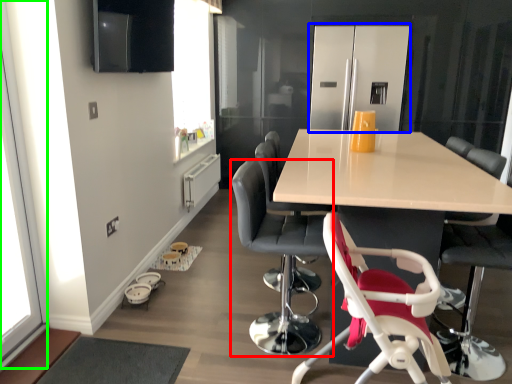
Question: Estimate the real-world distances between objects in this image. Which object is farther from chair (highlighted by a red box), appliance (highlighted by a blue box) or window screen (highlighted by a green box)?

Choices:
 (A) appliance
 (B) window screen

Answer: (A)